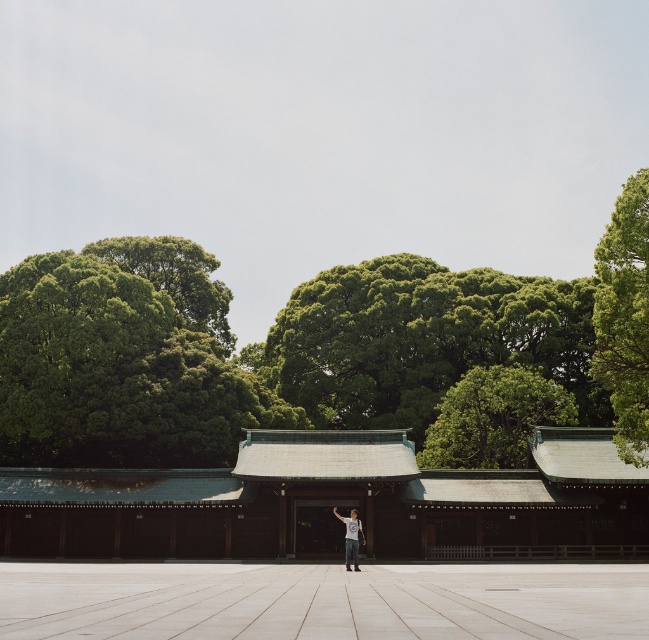
This screenshot has height=640, width=649. What do you see at coordinates (336, 502) in the screenshot? I see `green copper roof at center` at bounding box center [336, 502].

Does green copper roof at center appear over white cotton shirt at center?

Yes.

Does point (221, 488) lie in front of point (345, 536)?

No, it is not.

Find the location of `green copper roof at center`. green copper roof at center is located at coordinates (336, 502).

Is green copper roof at center to the right of green leafy tree at upper right from the viewer's perspective?

No, green copper roof at center is not to the right of green leafy tree at upper right.

Is green copper roof at center above green leafy tree at upper right?

Incorrect, green copper roof at center is not positioned above green leafy tree at upper right.

What are the coordinates of `green copper roof at center` in the screenshot? It's located at (336, 502).

What are the coordinates of `green copper roof at center` in the screenshot? It's located at (336, 502).

Between green leafy tree at upper right and green leafy tree at center, which one appears on the left side from the viewer's perspective?

green leafy tree at center

Who is higher up, green leafy tree at upper right or green leafy tree at center?

green leafy tree at upper right is above.

Is point (628, 368) positioned in front of point (435, 444)?

Yes, it is in front of point (435, 444).

Locate an element on the screen. Image resolution: width=649 pixels, height=640 pixels. green leafy tree at upper right is located at coordinates (624, 317).